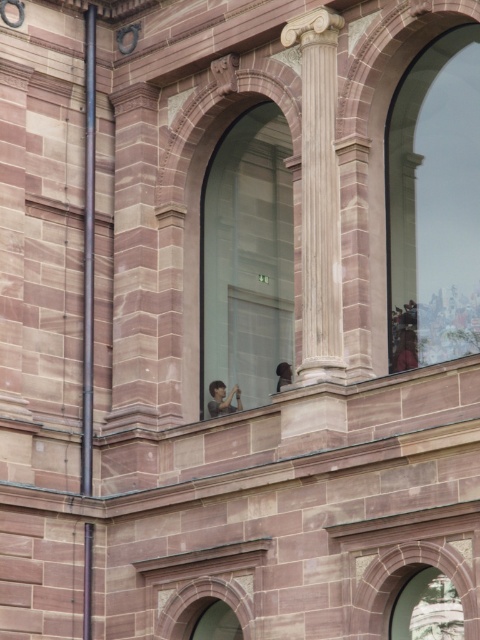
Question: Does transparent glass window at upper right have a smaller size compared to smooth skin face at center?

Choices:
 (A) no
 (B) yes

Answer: (B)

Question: Does transparent glass window at upper right have a smaller size compared to transparent glass window at center?

Choices:
 (A) yes
 (B) no

Answer: (A)

Question: Which object is the closest to the smooth stone pole at left?

Choices:
 (A) transparent glass window at upper right
 (B) dark brown hair at upper center

Answer: (B)

Question: Which is nearer to the transparent glass window at center?

Choices:
 (A) smooth stone pole at left
 (B) transparent glass window at upper right

Answer: (A)

Question: Is transparent glass window at upper right positioned behind transparent glass window at center?

Choices:
 (A) yes
 (B) no

Answer: (B)

Question: Which of these objects is positioned farthest from the transparent glass window at center?

Choices:
 (A) polished stone column at center
 (B) smooth skin face at center
 (C) dark brown hair at upper center

Answer: (A)